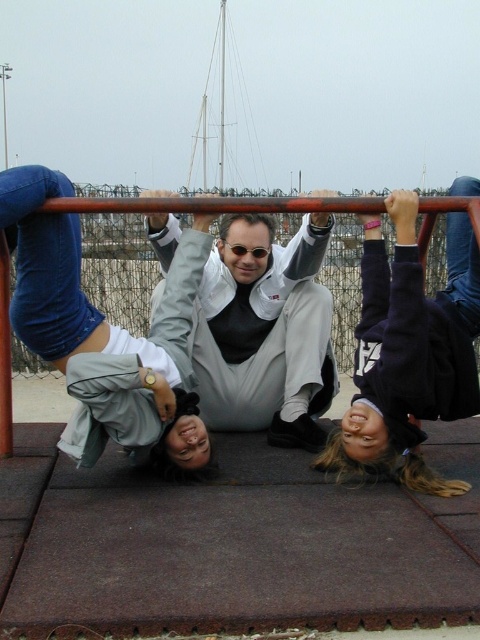
I want to click on dark blue sweater at center, so click(408, 353).

The height and width of the screenshot is (640, 480). In order to click on dark blue sweater at center in this screenshot , I will do `click(408, 353)`.